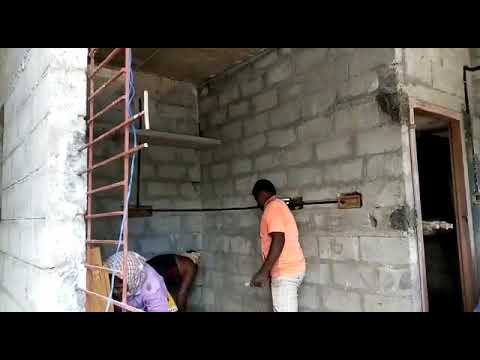
Where is `ceiling`? The width and height of the screenshot is (480, 360). ceiling is located at coordinates (185, 69).